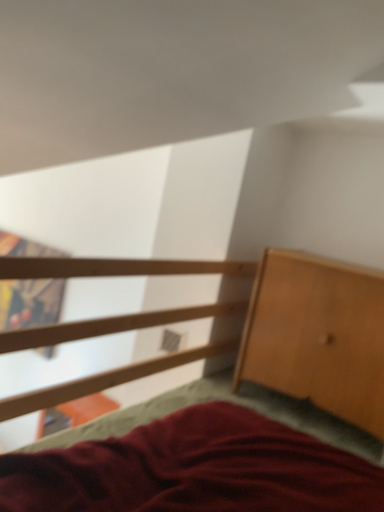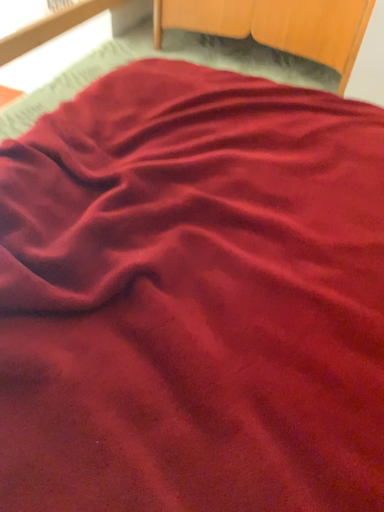
Question: How did the camera likely rotate when shooting the video?

Choices:
 (A) rotated right
 (B) rotated left

Answer: (A)